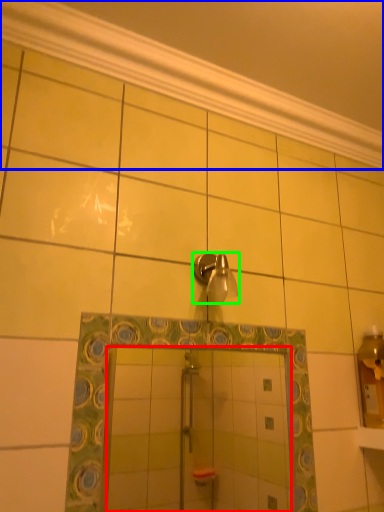
Question: Which is nearer to the mirror (highlighted by a red box)? molding (highlighted by a blue box) or shower (highlighted by a green box).

Choices:
 (A) molding
 (B) shower

Answer: (B)